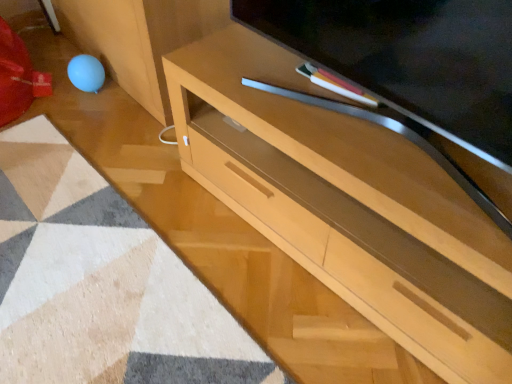
Locate an element on the screen. The height and width of the screenshot is (384, 512). vacant space situated above light wood desk at center (from a real-world perspective) is located at coordinates (356, 118).